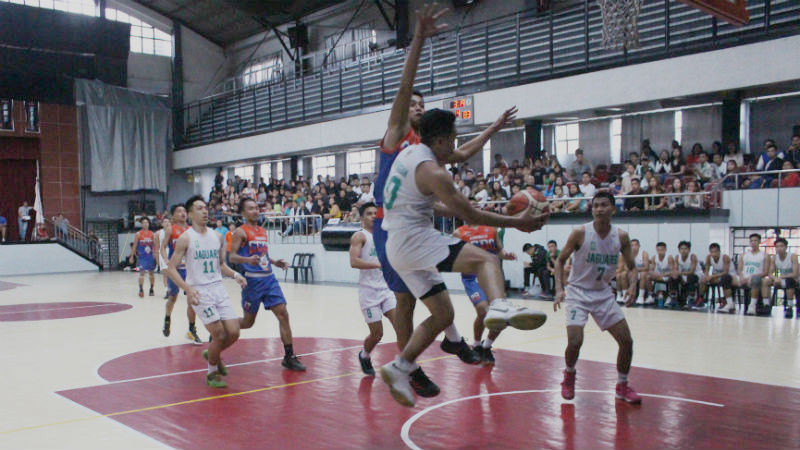
Where is `red circular shape on floor`? The height and width of the screenshot is (450, 800). red circular shape on floor is located at coordinates (54, 312).